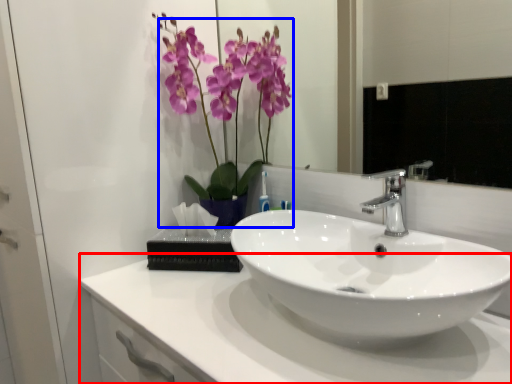
Question: Among these objects, which one is nearest to the camera, counter top (highlighted by a red box) or floral arrangement (highlighted by a blue box)?

Choices:
 (A) counter top
 (B) floral arrangement

Answer: (A)